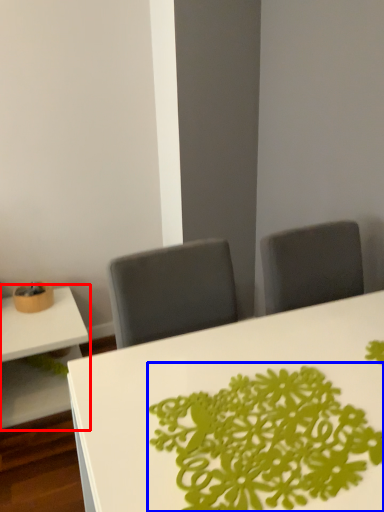
Question: Which of the following is the farthest to the observer, table (highlighted by a red box) or floral arrangement (highlighted by a blue box)?

Choices:
 (A) table
 (B) floral arrangement

Answer: (A)